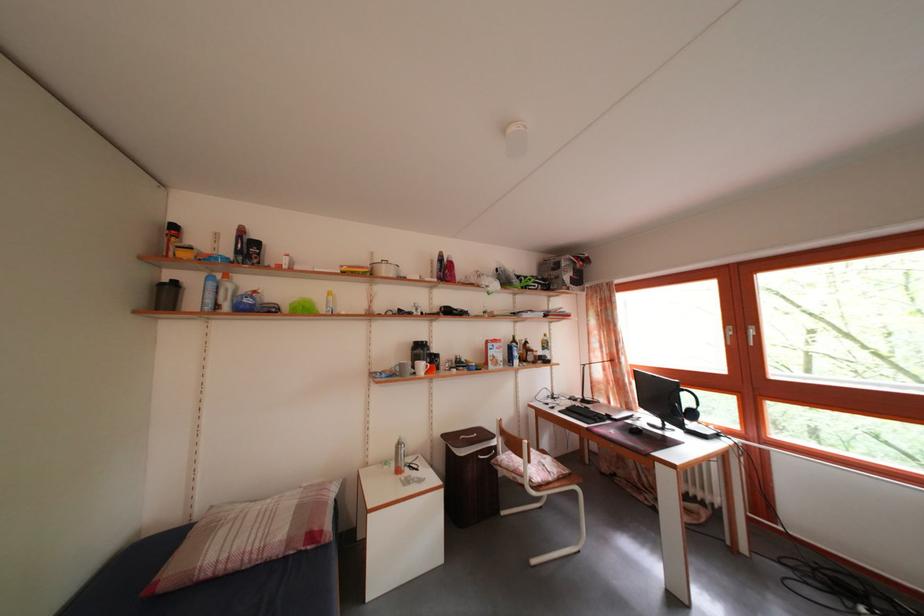
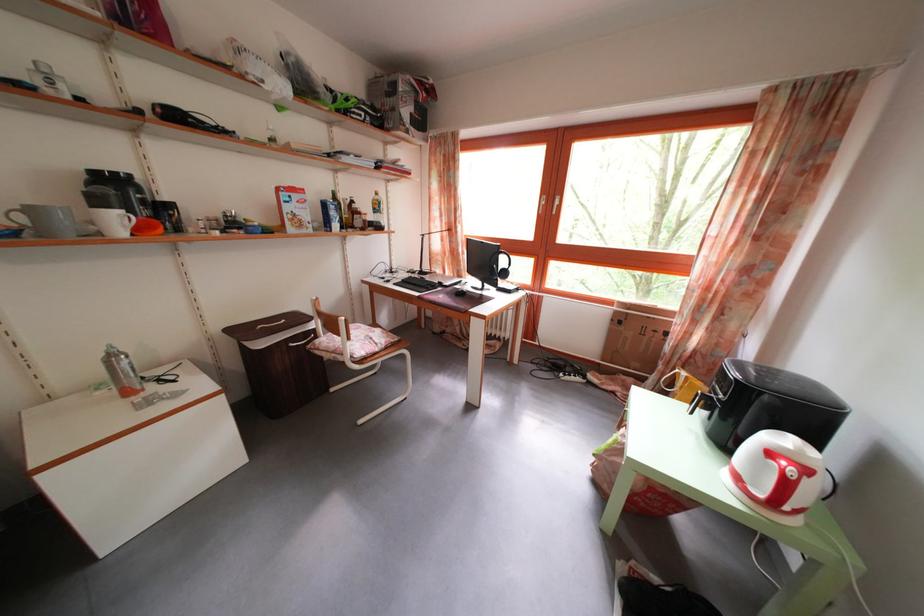
Locate, in the second image, the point that corresponds to (405,376) in the first image.

(30, 225)